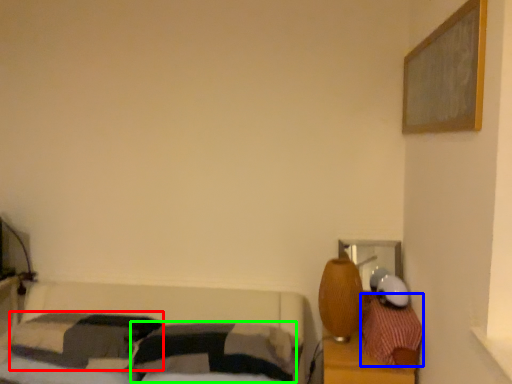
Question: Estimate the real-world distances between objects in this image. Which object is farther from pillow (highlighted by a red box), pillow (highlighted by a blue box) or pillow (highlighted by a green box)?

Choices:
 (A) pillow
 (B) pillow

Answer: (A)